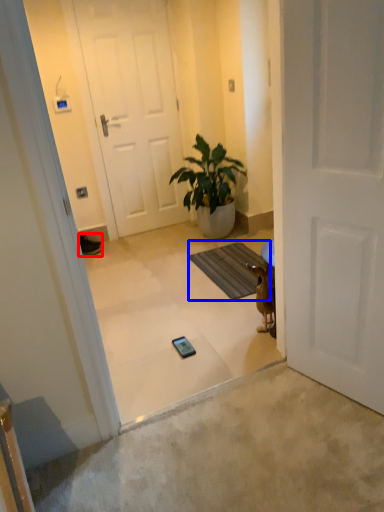
Question: Among these objects, which one is nearest to the camera, sneakers (highlighted by a red box) or bath mat (highlighted by a blue box)?

Choices:
 (A) sneakers
 (B) bath mat

Answer: (B)